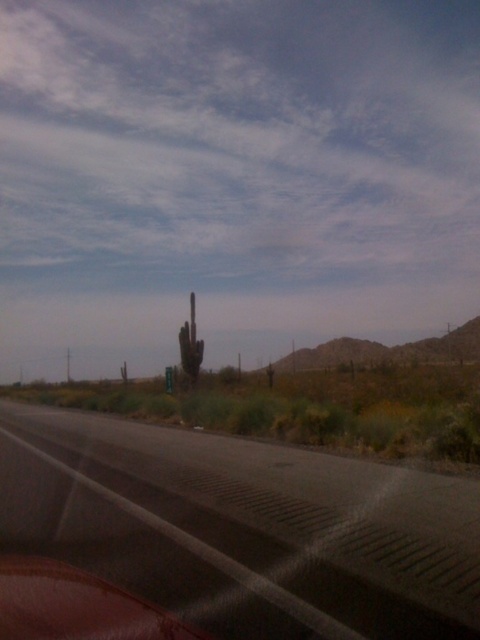
You are driving a car and see the point at coordinates (243, 528) on your windshield. Based on the scene, where is this point located relative to the road?

The point at coordinates (243, 528) is located on the black asphalt highway at lower center.

You are driving a car and see the black asphalt highway at lower center and the green spiky cactus at center. Which object is positioned to the right side of the other?

The black asphalt highway at lower center is to the right of the green spiky cactus at center.